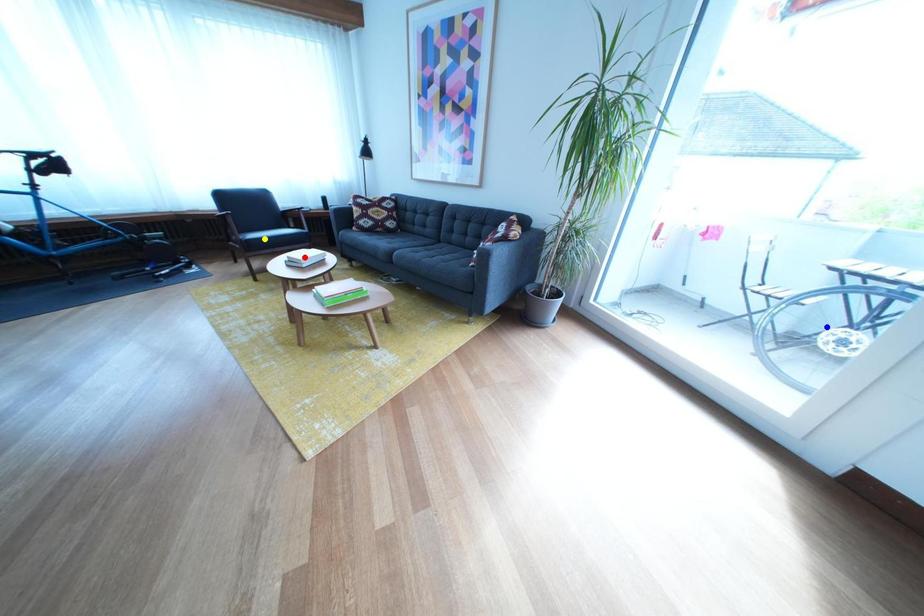
In the scene shown: Order these from nearest to farthest:
- blue point
- yellow point
- red point

yellow point
red point
blue point